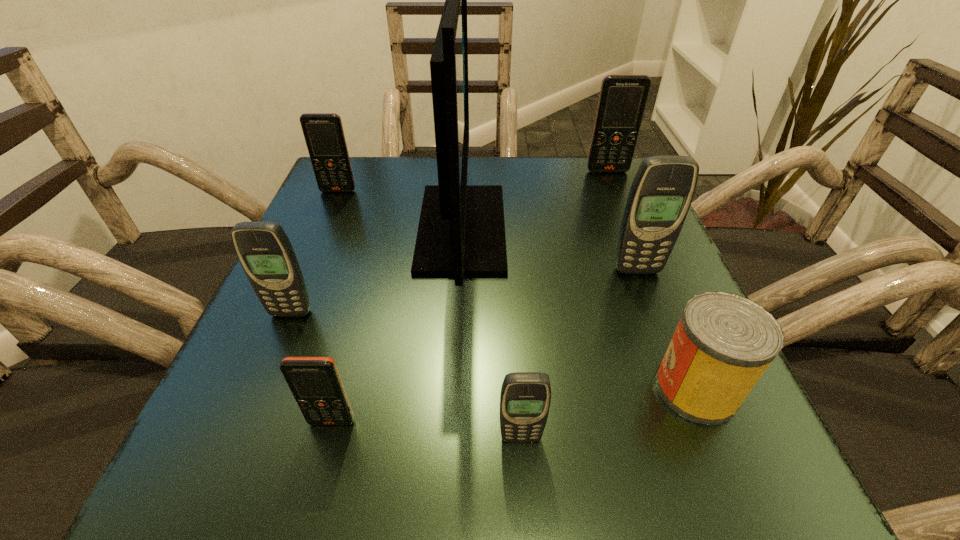
Where is `the tallest object`? the tallest object is located at coordinates 461,232.

I want to click on monitor, so click(x=461, y=232).

Identify the location of the farthest orange cellular telephone. The height and width of the screenshot is (540, 960). (622, 100).

In order to click on the biggest orange cellular telephone in this screenshot , I will do `click(622, 100)`.

Image resolution: width=960 pixels, height=540 pixels. In order to click on the biggest gray cellular telephone in this screenshot , I will do `click(662, 191)`.

Locate an element on the screen. Image resolution: width=960 pixels, height=540 pixels. the farthest gray cellular telephone is located at coordinates (662, 191).

The height and width of the screenshot is (540, 960). I want to click on the second smallest gray cellular telephone, so click(x=265, y=252).

Where is `the second farthest gray cellular telephone`? The width and height of the screenshot is (960, 540). the second farthest gray cellular telephone is located at coordinates (265, 252).

The height and width of the screenshot is (540, 960). Find the location of `the leftmost orange cellular telephone`. the leftmost orange cellular telephone is located at coordinates (323, 132).

Locate an element on the screen. The image size is (960, 540). the second biggest orange cellular telephone is located at coordinates (323, 132).